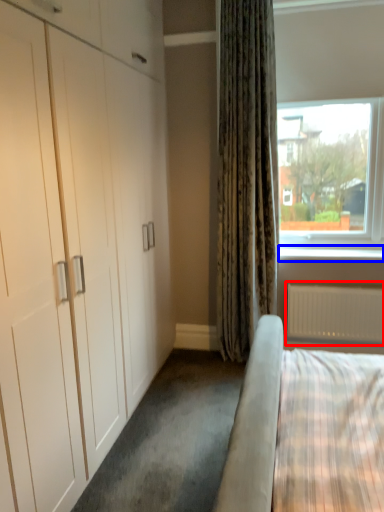
Question: Which object appears farthest to the camera in this image, radiator (highlighted by a red box) or window sill (highlighted by a blue box)?

Choices:
 (A) radiator
 (B) window sill

Answer: (B)